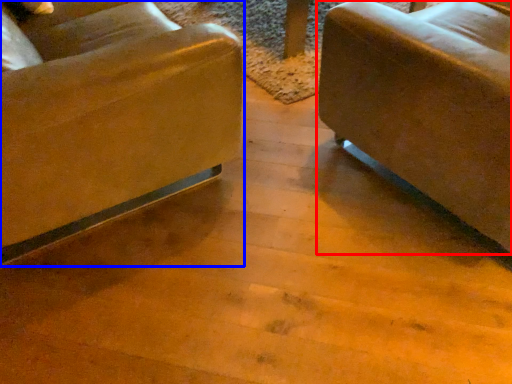
Question: Which object appears closest to the camera in this image, studio couch (highlighted by a red box) or chair (highlighted by a blue box)?

Choices:
 (A) studio couch
 (B) chair

Answer: (B)